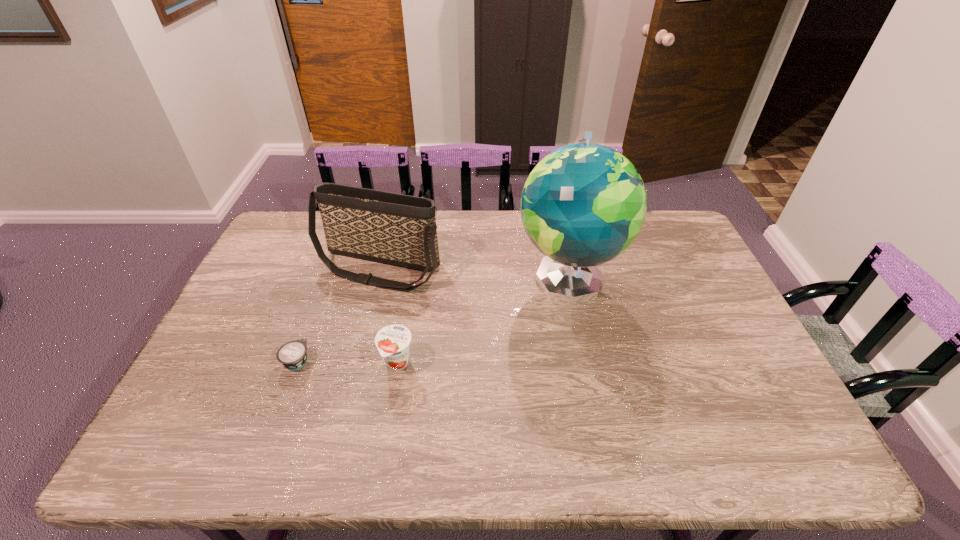
Locate an element on the screen. free space between the second tallest object and the right yogurt is located at coordinates (388, 315).

Find the location of a particular element. The height and width of the screenshot is (540, 960). free space between the left yogurt and the third shortest object is located at coordinates (338, 314).

Where is `blank region between the right yogurt and the tallest object`? blank region between the right yogurt and the tallest object is located at coordinates (483, 320).

This screenshot has width=960, height=540. In order to click on free space between the tallest object and the second tallest object in this screenshot , I will do [473, 272].

Identify the location of vacant area that lies between the second shortest object and the left yogurt. (348, 362).

You are a GUI agent. You are given a task and a screenshot of the screen. Output one action in this format:
    pyautogui.click(x=<x>, y=<y>)
    Task: Click on the vacant point located between the second shortest object and the left yogurt
    The height and width of the screenshot is (540, 960).
    Given the screenshot: What is the action you would take?
    pyautogui.click(x=348, y=362)

Locate an element on the screen. The width and height of the screenshot is (960, 540). free spot between the left yogurt and the second tallest object is located at coordinates (338, 314).

Where is `free area in between the second tallest object and the left yogurt`? The width and height of the screenshot is (960, 540). free area in between the second tallest object and the left yogurt is located at coordinates (338, 314).

I want to click on blank region between the handbag and the shorter yogurt, so click(338, 314).

The height and width of the screenshot is (540, 960). What are the coordinates of `vacant area between the third tallest object and the shortest object` in the screenshot? It's located at (348, 362).